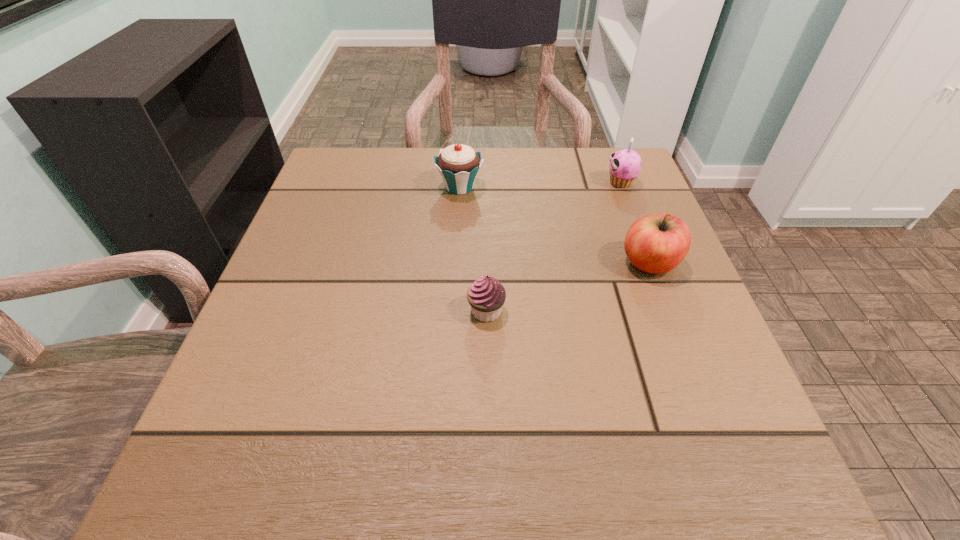
At what (x,y) coordinates should I click in order to perform the action: click on apple that is at the right edge. Please return your answer as a coordinate pair (x, y). The width and height of the screenshot is (960, 540). Looking at the image, I should click on (656, 243).

Where is `object that is at the far right corner`? object that is at the far right corner is located at coordinates (625, 165).

The width and height of the screenshot is (960, 540). I want to click on vacant space at the far edge of the desktop, so click(x=522, y=167).

You are a GUI agent. You are given a task and a screenshot of the screen. Output one action in this format:
    pyautogui.click(x=<x>, y=<y>)
    Task: Click on the vacant area at the near edge
    This screenshot has height=540, width=960.
    Given the screenshot: What is the action you would take?
    pyautogui.click(x=418, y=457)

Find the location of `vacant area at the left edge`. vacant area at the left edge is located at coordinates (300, 252).

Locate an element on the screen. vacant area at the right edge is located at coordinates coord(731,397).

Locate an element on the screen. The height and width of the screenshot is (540, 960). free region at the far left corner of the desktop is located at coordinates (387, 177).

Identify the location of vacant space at the near left corner. This screenshot has height=540, width=960. (191, 464).

This screenshot has width=960, height=540. Find the location of `free space at the far right corner of the desktop`. free space at the far right corner of the desktop is located at coordinates (588, 179).

The width and height of the screenshot is (960, 540). In order to click on vacant space that is in between the apple and the shortest object in this screenshot , I will do `click(567, 287)`.